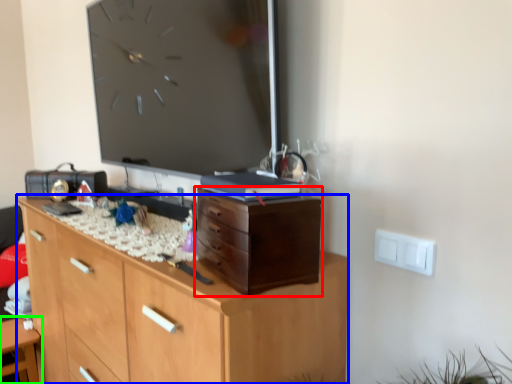
Question: Which is nearer to the chest of drawers (highlighted by a red box)? chest of drawers (highlighted by a blue box) or table (highlighted by a green box).

Choices:
 (A) chest of drawers
 (B) table

Answer: (A)